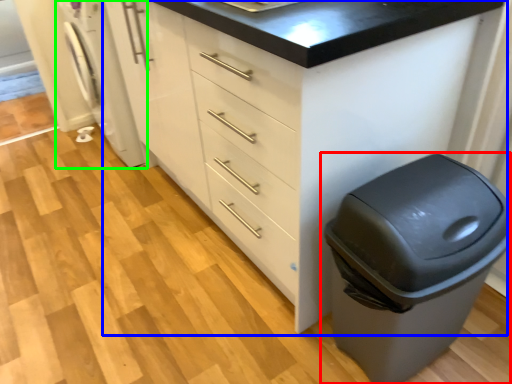
Question: Considering the real-world distances, which object is closest to waste container (highlighted by a red box)? chest of drawers (highlighted by a blue box) or washing machine (highlighted by a green box).

Choices:
 (A) chest of drawers
 (B) washing machine

Answer: (A)